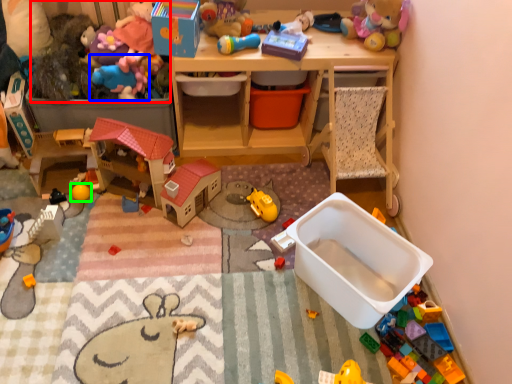
Question: Estimate the real-world distances between objects in this image. Which object is farther from toy (highlighted by a red box), toy (highlighted by a blue box) or toy (highlighted by a green box)?

Choices:
 (A) toy
 (B) toy

Answer: (B)